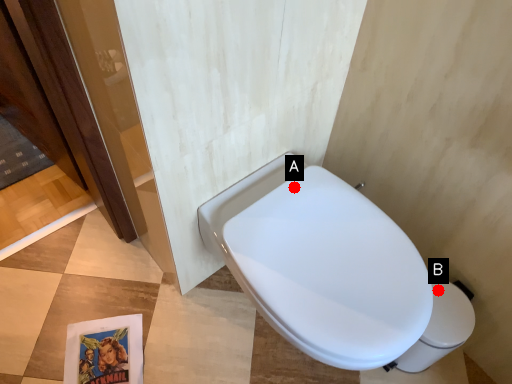
Question: Two points are circled on the image, labeled by A and B beside each circle. Among these points, which one is farthest from the camera?

Choices:
 (A) A is further
 (B) B is further

Answer: (B)